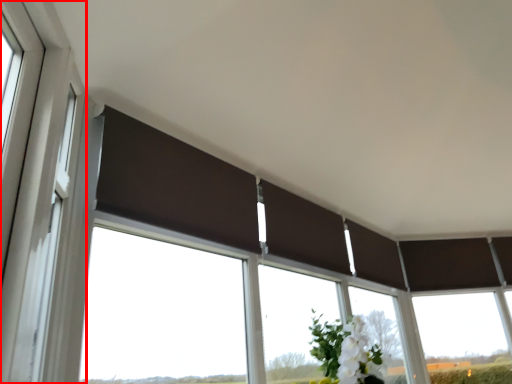
Question: From the image's perspective, considering the relative positions of window frame (annotated by the red box) and window in the image provided, where is window frame (annotated by the red box) located with respect to the staircase?

Choices:
 (A) below
 (B) above

Answer: (B)